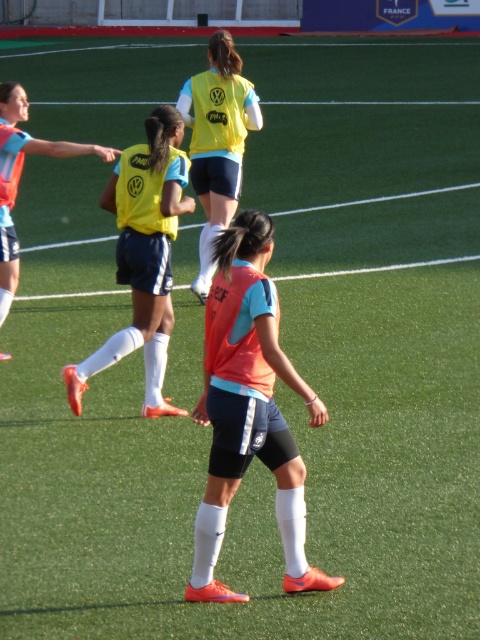
You are a soccer coach analyzing a training session. You notice a point marked at coordinates (143,253) on the field. What object is located at that specific coordinate?

The yellow matte jersey at center is located at point (143,253).

You are a coach observing the soccer training session. You notice the yellow matte vest at center and the matte orange jersey at left. Which piece of clothing is smaller in size?

The yellow matte vest at center is smaller in size compared to the matte orange jersey at left.

You are a soccer coach observing the training session. You notice an orange matte vest at center on the field. Can you estimate its position using a coordinate system where the bottom left corner is the origin point? Please provide the coordinates as a pair of numbers between 0 and 1.

The orange matte vest at center is located at coordinates approximately 0.637 in the x axis and 0.519 in the y axis.